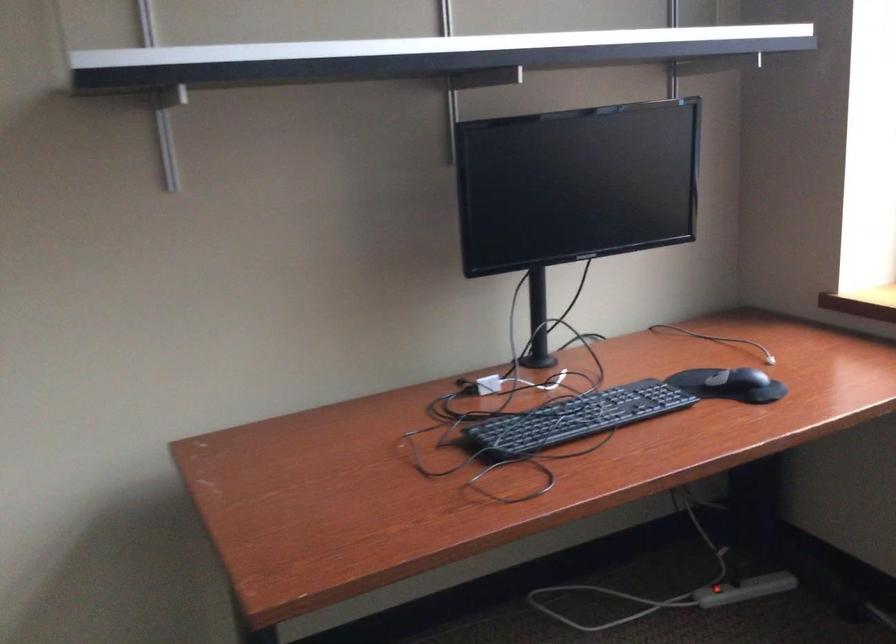
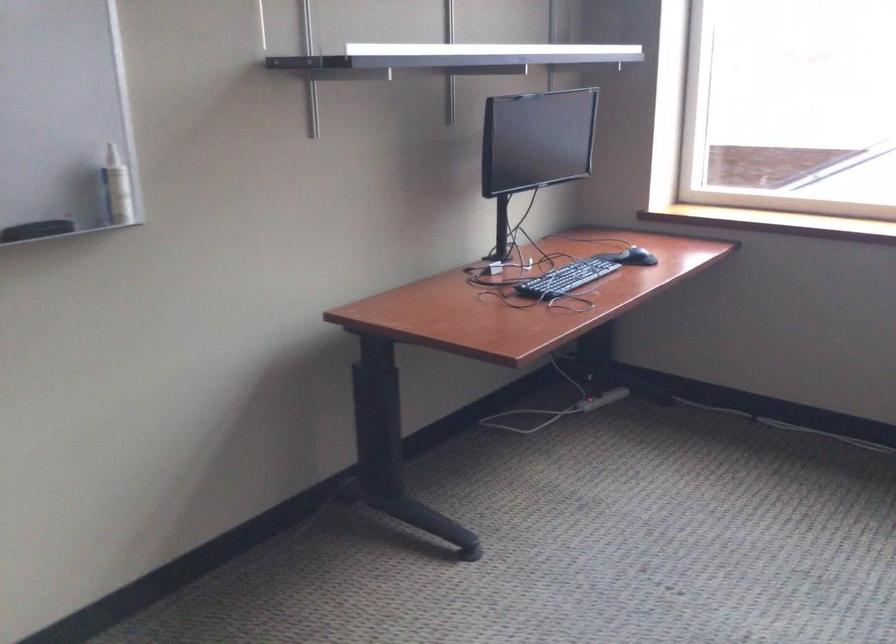
In the second image, find the point that corresponds to (741,389) in the first image.

(636, 257)